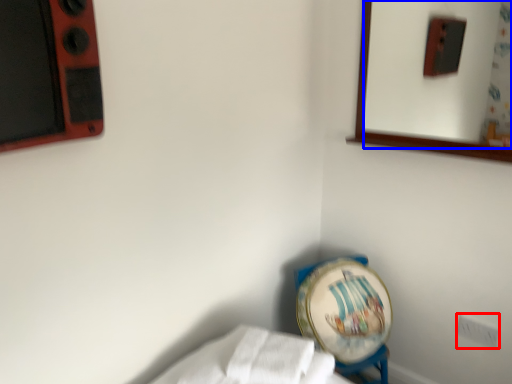
Question: Which point is closer to the camera, electric outlet (highlighted by a red box) or mirror (highlighted by a blue box)?

Choices:
 (A) electric outlet
 (B) mirror

Answer: (B)